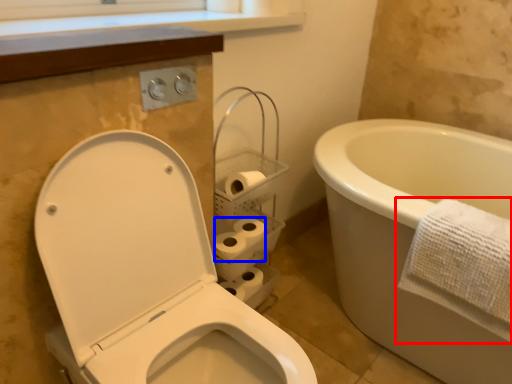
Question: Which object is further to the camera taking this photo, towel (highlighted by a red box) or toilet paper (highlighted by a blue box)?

Choices:
 (A) towel
 (B) toilet paper

Answer: (B)